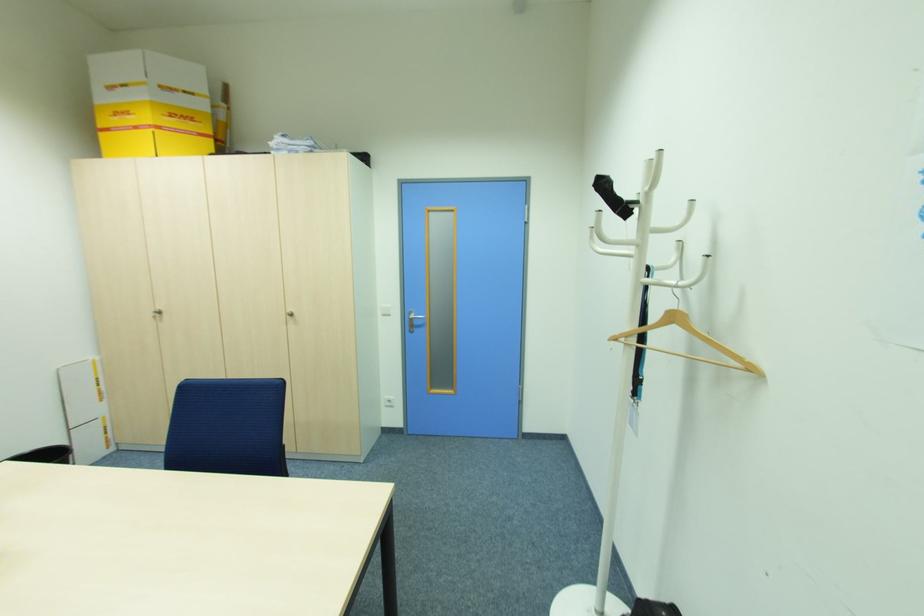
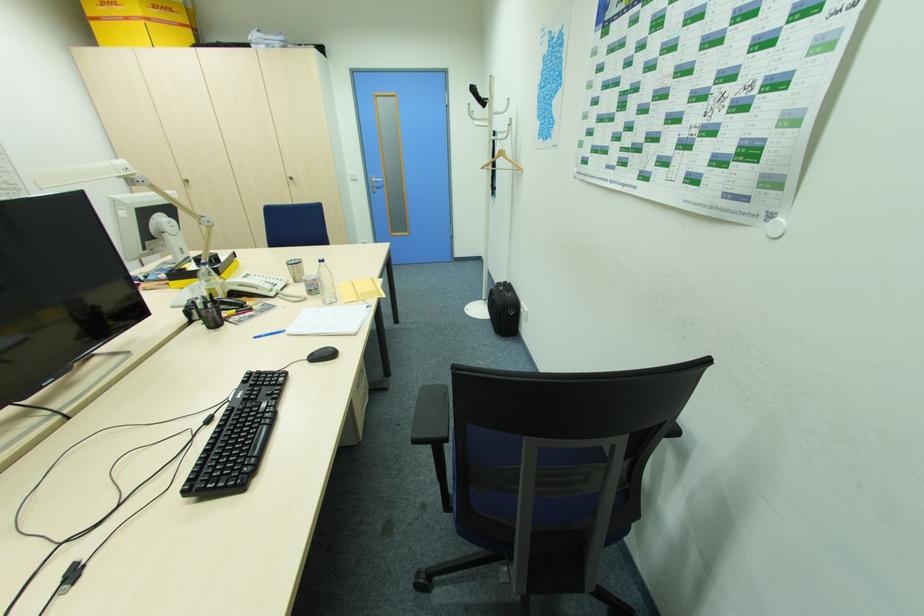
In the second image, find the point that corresponds to [156,317] in the first image.

(188, 185)